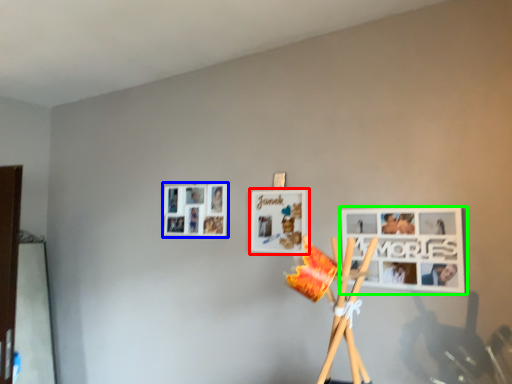
Question: Which object is the closest to the picture frame (highlighted by a red box)? Choose among these: picture frame (highlighted by a blue box) or picture frame (highlighted by a green box).

Choices:
 (A) picture frame
 (B) picture frame

Answer: (A)